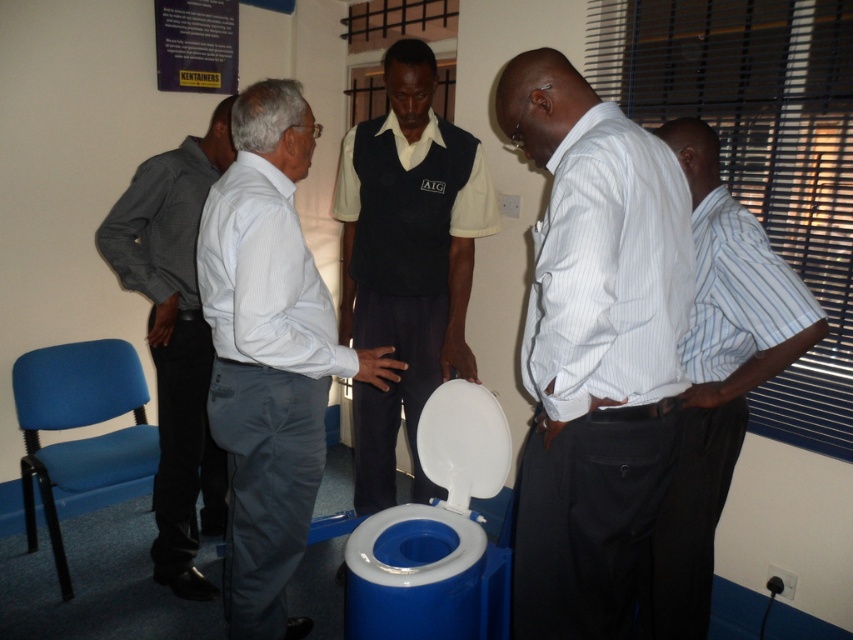
Looking at this image, you are a photographer setting up for a group photo in the scene described. You need to position the white striped shirt at center and dark gray shirt at left so that both are visible in the frame. Given their heights, which shirt should you place closer to the camera to ensure both are fully visible?

The white striped shirt at center is shorter than the dark gray shirt at left. To ensure both are fully visible, position the white striped shirt at center closer to the camera so its shorter height doesn

You are a security guard in the room. You need to check the distance between the white striped shirt at center and the dark gray shirt at left to ensure social distancing. Can you confirm if they are at least 1.5 meters apart?

The distance between the white striped shirt at center and the dark gray shirt at left is 1.40 meters, which is less than the required 1.5 meters for social distancing. They are too close.

You are a photographer trying to capture a candid shot of the dark blue vest at center and the dark gray shirt at left. Since you want to frame both subjects in the same photo, which direction should you move to ensure both are visible in your camera viewfinder?

The dark blue vest at center is positioned on the right side of dark gray shirt at left, so you should move to the left side to include both subjects in your camera viewfinder.